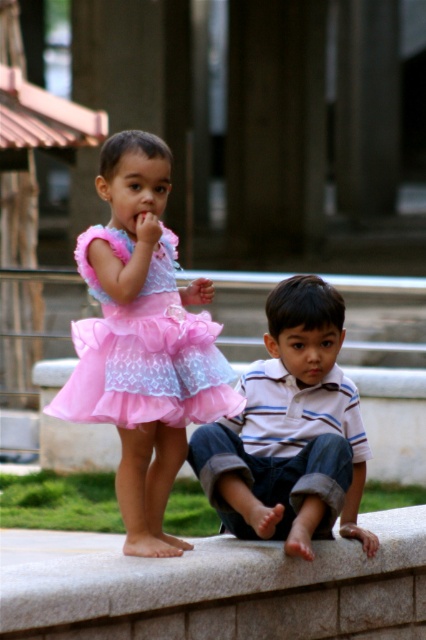
Question: Which is nearer to the pink tulle dress at upper left?

Choices:
 (A) pink tulle dress at left
 (B) granite ledge at lower center
 (C) striped cotton shirt at center

Answer: (A)

Question: Is pink tulle dress at upper left positioned in front of pink tulle dress at left?

Choices:
 (A) no
 (B) yes

Answer: (B)

Question: Estimate the real-world distances between objects in this image. Which object is closer to the pink tulle dress at upper left?

Choices:
 (A) granite ledge at lower center
 (B) pink tulle dress at left

Answer: (B)

Question: Which object is closer to the camera taking this photo?

Choices:
 (A) pink tulle dress at left
 (B) granite ledge at lower center
 (C) pink tulle dress at upper left
 (D) striped cotton shirt at center

Answer: (B)

Question: From the image, what is the correct spatial relationship of granite ledge at lower center in relation to striped cotton shirt at center?

Choices:
 (A) above
 (B) below

Answer: (B)

Question: From the image, what is the correct spatial relationship of granite ledge at lower center in relation to pink tulle dress at left?

Choices:
 (A) left
 (B) right

Answer: (B)